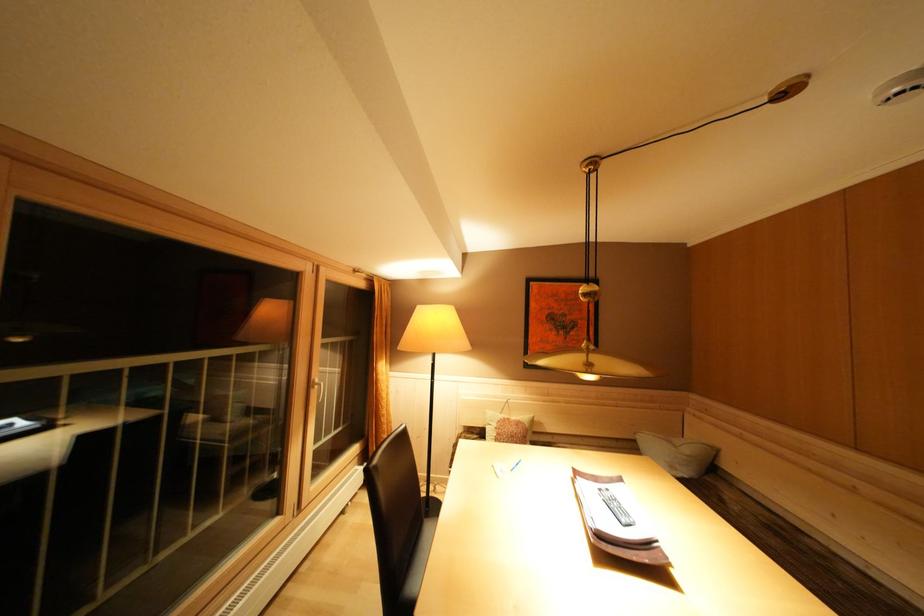
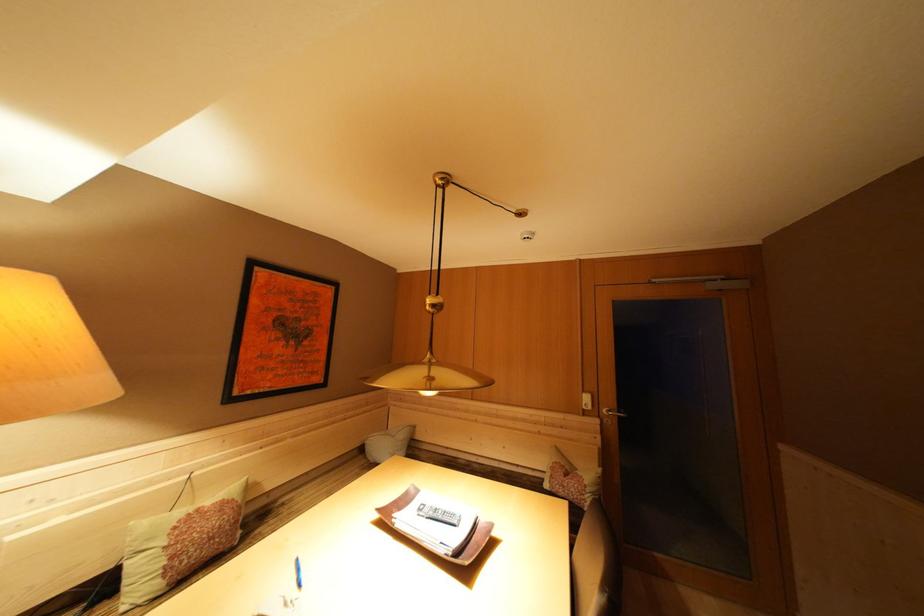
Locate, in the second image, the point that corresponds to pixel 695 456 in the first image.

(408, 440)